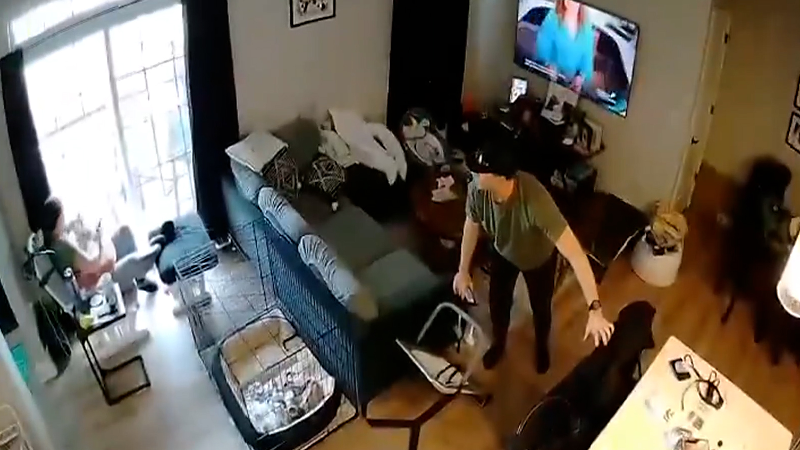
The width and height of the screenshot is (800, 450). In order to click on curtain in this screenshot , I will do `click(208, 63)`.